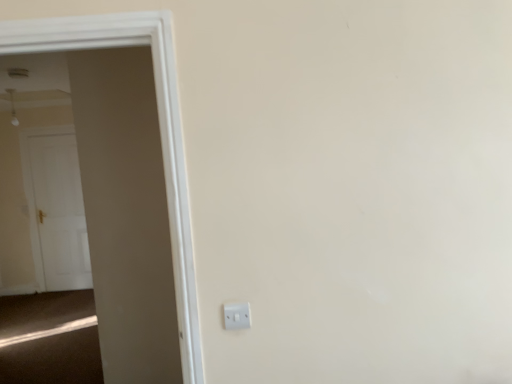
Question: From a real-world perspective, is white wooden door at left, which is the second door from left to right, beneath white glossy door at left, which is the 1th door in back-to-front order?

Choices:
 (A) yes
 (B) no

Answer: (B)

Question: Is white wooden door at left, which is the second door from left to right, to the right of white glossy door at left, the second door positioned from the front, from the viewer's perspective?

Choices:
 (A) yes
 (B) no

Answer: (A)

Question: From a real-world perspective, is white wooden door at left, which appears as the first door when viewed from the right, positioned over white glossy door at left, placed as the first door when sorted from left to right, based on gravity?

Choices:
 (A) yes
 (B) no

Answer: (A)

Question: Would you say white glossy door at left, which is the 1th door in back-to-front order, is part of white wooden door at left, which appears as the first door when viewed from the right,'s contents?

Choices:
 (A) no
 (B) yes

Answer: (A)

Question: Considering the relative sizes of white wooden door at left, which is the 2th door in back-to-front order, and white glossy door at left, the second door positioned from the front, in the image provided, is white wooden door at left, which is the 2th door in back-to-front order, bigger than white glossy door at left, the second door positioned from the front,?

Choices:
 (A) yes
 (B) no

Answer: (A)

Question: Are white wooden door at left, which is the 2th door in back-to-front order, and white glossy door at left, the second door when ordered from right to left, located far from each other?

Choices:
 (A) no
 (B) yes

Answer: (B)

Question: Is white glossy door at left, the second door positioned from the front, aimed at white wooden door at left, which is the 2th door in back-to-front order?

Choices:
 (A) yes
 (B) no

Answer: (B)

Question: Can you confirm if white glossy door at left, the second door when ordered from right to left, is wider than white wooden door at left, which appears as the 1th door when viewed from the front?

Choices:
 (A) no
 (B) yes

Answer: (A)

Question: Is the position of white glossy door at left, the second door when ordered from right to left, more distant than that of white wooden door at left, which is the 2th door in back-to-front order?

Choices:
 (A) no
 (B) yes

Answer: (B)

Question: From a real-world perspective, is white glossy door at left, the second door when ordered from right to left, located beneath white wooden door at left, which appears as the first door when viewed from the right?

Choices:
 (A) no
 (B) yes

Answer: (B)

Question: Is white glossy door at left, placed as the first door when sorted from left to right, surrounding white wooden door at left, which is the second door from left to right?

Choices:
 (A) yes
 (B) no

Answer: (B)

Question: Can you confirm if white glossy door at left, placed as the first door when sorted from left to right, is smaller than white wooden door at left, which appears as the 1th door when viewed from the front?

Choices:
 (A) yes
 (B) no

Answer: (A)

Question: Can you see white wooden door at left, which appears as the 1th door when viewed from the front, touching white plastic electric outlet at lower center?

Choices:
 (A) no
 (B) yes

Answer: (A)